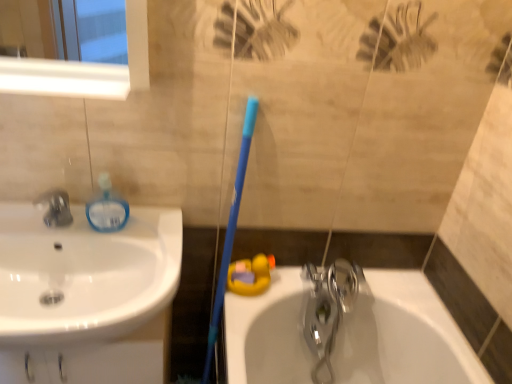
What do you see at coordinates (327, 310) in the screenshot?
I see `polished chrome faucet at lower center, arranged as the first tap when viewed from the back` at bounding box center [327, 310].

You are a GUI agent. You are given a task and a screenshot of the screen. Output one action in this format:
    pyautogui.click(x=<x>, y=<y>)
    Task: Click on the polished chrome faucet at lower center, the 1th tap positioned from the bottom
    
    Given the screenshot: What is the action you would take?
    pyautogui.click(x=327, y=310)

Considering the points (356, 285) and (248, 146), which point is in front, point (356, 285) or point (248, 146)?

The point (248, 146) is closer.

Between polished chrome faucet at lower center, the 1th tap positioned from the bottom, and blue plastic toothbrush at center, which one has less height?

Standing shorter between the two is polished chrome faucet at lower center, the 1th tap positioned from the bottom.

From the image's perspective, which object appears higher, polished chrome faucet at lower center, arranged as the 1th tap when viewed from the right, or blue plastic toothbrush at center?

blue plastic toothbrush at center is shown above in the image.

Which of these two, polished chrome faucet at lower center, which is counted as the 2th tap, starting from the left, or white glossy sink at left, stands taller?

polished chrome faucet at lower center, which is counted as the 2th tap, starting from the left.

Image resolution: width=512 pixels, height=384 pixels. Identify the location of sink above the polished chrome faucet at lower center, arranged as the 1th tap when viewed from the right (from a real-world perspective). (84, 274).

Measure the distance between polished chrome faucet at lower center, arranged as the 1th tap when viewed from the right, and white glossy sink at left.

The distance of polished chrome faucet at lower center, arranged as the 1th tap when viewed from the right, from white glossy sink at left is 25.10 inches.

Considering the relative sizes of blue plastic toothbrush at center and polished chrome faucet at lower center, the 2th tap when ordered from top to bottom, in the image provided, is blue plastic toothbrush at center taller than polished chrome faucet at lower center, the 2th tap when ordered from top to bottom,?

Yes, blue plastic toothbrush at center is taller than polished chrome faucet at lower center, the 2th tap when ordered from top to bottom.

Could you measure the distance between blue plastic toothbrush at center and polished chrome faucet at lower center, arranged as the first tap when viewed from the back?

The distance of blue plastic toothbrush at center from polished chrome faucet at lower center, arranged as the first tap when viewed from the back, is 14.34 inches.

Which is behind, blue plastic toothbrush at center or polished chrome faucet at lower center, which is counted as the 2th tap, starting from the left?

polished chrome faucet at lower center, which is counted as the 2th tap, starting from the left, is further from the camera.

Is blue plastic toothbrush at center in contact with polished chrome faucet at lower center, the 1th tap positioned from the bottom?

No, blue plastic toothbrush at center is not next to polished chrome faucet at lower center, the 1th tap positioned from the bottom.

Which of these two, polished chrome faucet at lower center, which is counted as the 2th tap, starting from the left, or matte black faucet at left, which ranks as the second tap in bottom-to-top order, is wider?

polished chrome faucet at lower center, which is counted as the 2th tap, starting from the left.

From the picture: Which of these two, polished chrome faucet at lower center, the 1th tap positioned from the bottom, or matte black faucet at left, positioned as the second tap in right-to-left order, stands shorter?

With less height is matte black faucet at left, positioned as the second tap in right-to-left order.

In terms of size, does polished chrome faucet at lower center, the 2th tap when ordered from top to bottom, appear bigger or smaller than matte black faucet at left, which ranks as the second tap in bottom-to-top order?

In the image, polished chrome faucet at lower center, the 2th tap when ordered from top to bottom, appears to be larger than matte black faucet at left, which ranks as the second tap in bottom-to-top order.

Based on the photo, is matte black faucet at left, positioned as the second tap in right-to-left order, far away from white glossy sink at left?

No, matte black faucet at left, positioned as the second tap in right-to-left order, is not far away from white glossy sink at left.

Which object is further away from the camera taking this photo, matte black faucet at left, the first tap when ordered from left to right, or white glossy sink at left?

matte black faucet at left, the first tap when ordered from left to right, is behind.

Considering the positions of objects matte black faucet at left, the first tap viewed from the top, and white glossy sink at left in the image provided, who is more to the left, matte black faucet at left, the first tap viewed from the top, or white glossy sink at left?

matte black faucet at left, the first tap viewed from the top, is more to the left.

Is matte black faucet at left, positioned as the second tap in right-to-left order, positioned with its back to white glossy sink at left?

No, matte black faucet at left, positioned as the second tap in right-to-left order, is not facing the opposite direction of white glossy sink at left.

Identify the location of sink above the polished chrome faucet at lower center, the 1th tap positioned from the bottom (from a real-world perspective). (84, 274).

Could you tell me if white glossy sink at left is facing polished chrome faucet at lower center, which is counted as the 2th tap, starting from the left?

No, white glossy sink at left is not turned towards polished chrome faucet at lower center, which is counted as the 2th tap, starting from the left.

Considering their positions, is white glossy sink at left located in front of or behind polished chrome faucet at lower center, the 2th tap when ordered from top to bottom?

In the image, white glossy sink at left appears in front of polished chrome faucet at lower center, the 2th tap when ordered from top to bottom.

Is white glossy sink at left not near polished chrome faucet at lower center, the 2th tap in the front-to-back sequence?

Actually, white glossy sink at left and polished chrome faucet at lower center, the 2th tap in the front-to-back sequence, are a little close together.

Which point is more forward, (250, 144) or (64, 281)?

The point (64, 281) is in front.

Can you confirm if blue plastic toothbrush at center is thinner than white glossy sink at left?

Indeed, blue plastic toothbrush at center has a lesser width compared to white glossy sink at left.

From a real-world perspective, which object stands above the other?

In real-world perspective, white glossy sink at left is above.

The image size is (512, 384). Find the location of `the 2nd tap behind the blue plastic toothbrush at center`. the 2nd tap behind the blue plastic toothbrush at center is located at coordinates (327, 310).

Locate an element on the screen. The width and height of the screenshot is (512, 384). tap below the white glossy sink at left (from the image's perspective) is located at coordinates (327, 310).

Looking at the image, which one is located closer to white glossy sink at left, matte black faucet at left, the first tap when ordered from left to right, or blue plastic toothbrush at center?

Among the two, matte black faucet at left, the first tap when ordered from left to right, is located nearer to white glossy sink at left.

Considering their positions, is matte black faucet at left, the first tap in the front-to-back sequence, positioned closer to blue plastic toothbrush at center than polished chrome faucet at lower center, the 1th tap positioned from the bottom?

Based on the image, polished chrome faucet at lower center, the 1th tap positioned from the bottom, appears to be nearer to blue plastic toothbrush at center.

Looking at the image, which one is located closer to matte black faucet at left, which ranks as the second tap in bottom-to-top order, white glossy sink at left or polished chrome faucet at lower center, the 2th tap in the front-to-back sequence?

Among the two, white glossy sink at left is located nearer to matte black faucet at left, which ranks as the second tap in bottom-to-top order.

Estimate the real-world distances between objects in this image. Which object is closer to polished chrome faucet at lower center, which is counted as the 2th tap, starting from the left, blue plastic toothbrush at center or white glossy sink at left?

blue plastic toothbrush at center lies closer to polished chrome faucet at lower center, which is counted as the 2th tap, starting from the left, than the other object.

From the image, which object appears to be farther from white glossy sink at left, matte black faucet at left, the first tap viewed from the top, or polished chrome faucet at lower center, which is counted as the 2th tap, starting from the left?

Based on the image, polished chrome faucet at lower center, which is counted as the 2th tap, starting from the left, appears to be further to white glossy sink at left.

When comparing their distances from blue plastic toothbrush at center, does white glossy sink at left or matte black faucet at left, the first tap viewed from the top, seem closer?

Among the two, white glossy sink at left is located nearer to blue plastic toothbrush at center.

When comparing their distances from polished chrome faucet at lower center, the 2th tap in the front-to-back sequence, does blue plastic toothbrush at center or matte black faucet at left, the 2th tap from the back, seem closer?

blue plastic toothbrush at center.

When comparing their distances from matte black faucet at left, the first tap when ordered from left to right, does white glossy sink at left or blue plastic toothbrush at center seem further?

blue plastic toothbrush at center lies further to matte black faucet at left, the first tap when ordered from left to right, than the other object.

This screenshot has height=384, width=512. In order to click on toothbrush between white glossy sink at left and polished chrome faucet at lower center, the 2th tap when ordered from top to bottom in this screenshot , I will do `click(230, 230)`.

Locate an element on the screen. toothbrush situated between matte black faucet at left, the 2th tap from the back, and polished chrome faucet at lower center, the 2th tap when ordered from top to bottom, from left to right is located at coordinates (230, 230).

You are a GUI agent. You are given a task and a screenshot of the screen. Output one action in this format:
    pyautogui.click(x=<x>, y=<y>)
    Task: Click on the sink located between matte black faucet at left, the first tap in the front-to-back sequence, and blue plastic toothbrush at center in the left-right direction
    This screenshot has height=384, width=512.
    Given the screenshot: What is the action you would take?
    pyautogui.click(x=84, y=274)

Locate an element on the screen. The image size is (512, 384). sink between matte black faucet at left, the first tap viewed from the top, and polished chrome faucet at lower center, the 2th tap when ordered from top to bottom is located at coordinates (84, 274).